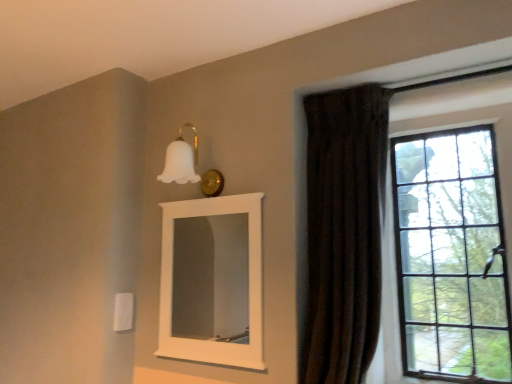
Question: Can we say white matte mirror at upper center lies outside clear glass window at right?

Choices:
 (A) yes
 (B) no

Answer: (A)

Question: Can you confirm if white matte mirror at upper center is shorter than clear glass window at right?

Choices:
 (A) yes
 (B) no

Answer: (A)

Question: Is the depth of white matte mirror at upper center less than that of clear glass window at right?

Choices:
 (A) yes
 (B) no

Answer: (B)

Question: From a real-world perspective, does white matte mirror at upper center stand above clear glass window at right?

Choices:
 (A) no
 (B) yes

Answer: (A)

Question: Is the surface of white matte mirror at upper center in direct contact with clear glass window at right?

Choices:
 (A) no
 (B) yes

Answer: (A)

Question: From the image's perspective, is white matte mirror at upper center located above or below clear glass window at right?

Choices:
 (A) below
 (B) above

Answer: (A)

Question: Is white matte mirror at upper center taller or shorter than clear glass window at right?

Choices:
 (A) short
 (B) tall

Answer: (A)

Question: Considering the positions of white matte mirror at upper center and clear glass window at right in the image, is white matte mirror at upper center wider or thinner than clear glass window at right?

Choices:
 (A) wide
 (B) thin

Answer: (B)

Question: Is point (177, 292) closer or farther from the camera than point (425, 150)?

Choices:
 (A) farther
 (B) closer

Answer: (A)

Question: Does point (335, 200) appear closer or farther from the camera than point (187, 180)?

Choices:
 (A) farther
 (B) closer

Answer: (B)

Question: In terms of height, does brown velvet curtain at right look taller or shorter compared to white matte glass sconce at upper center?

Choices:
 (A) short
 (B) tall

Answer: (B)

Question: From a real-world perspective, is brown velvet curtain at right physically located above or below white matte glass sconce at upper center?

Choices:
 (A) above
 (B) below

Answer: (B)

Question: In the image, is brown velvet curtain at right positioned in front of or behind white matte glass sconce at upper center?

Choices:
 (A) behind
 (B) front

Answer: (B)

Question: From their relative heights in the image, would you say brown velvet curtain at right is taller or shorter than white matte mirror at upper center?

Choices:
 (A) short
 (B) tall

Answer: (B)

Question: Would you say brown velvet curtain at right is to the left or to the right of white matte mirror at upper center in the picture?

Choices:
 (A) right
 (B) left

Answer: (A)